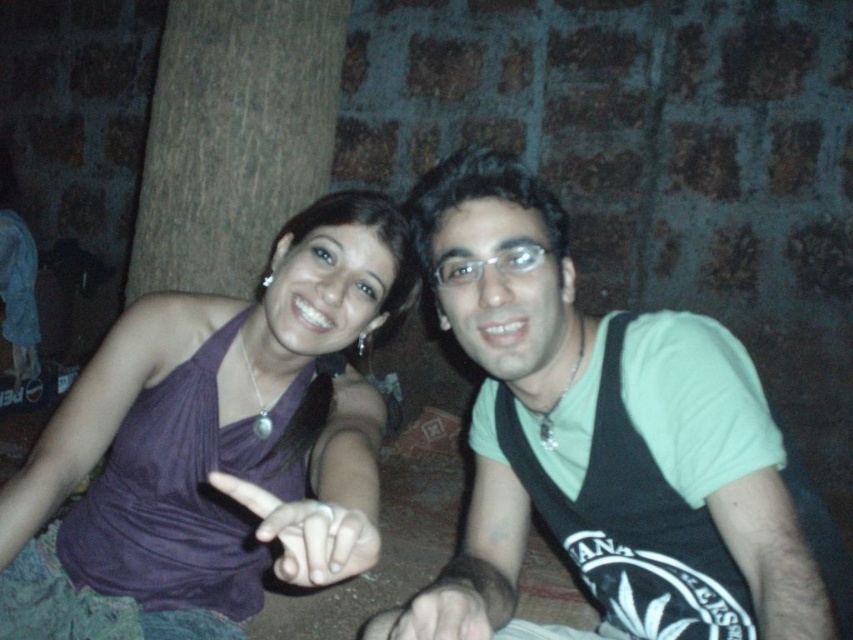
What are the coordinates of the brown wood tree at upper left in the image?

The brown wood tree at upper left is located at coordinates (233, 138).

You are a photographer adjusting your camera settings to focus on the green matte shirt at center and the smooth skin hand at center in the image. Which object should you focus on first if you want to capture both clearly in the same frame?

The green matte shirt at center is above the smooth skin hand at center, so focusing on the green matte shirt at center first would ensure it is in the foreground and the hand might be slightly out of focus. Alternatively, adjusting the focus to a point between them or using a smaller aperture for greater depth of field would better capture both clearly.

You are a photographer trying to capture a closeup of the brown wood tree at upper left and the smooth skin hand at center in the scene. Which object should you zoom in on to get a larger subject in your photo?

The brown wood tree at upper left is bigger than the smooth skin hand at center, so you should zoom in on the brown wood tree at upper left to get a larger subject in your photo.